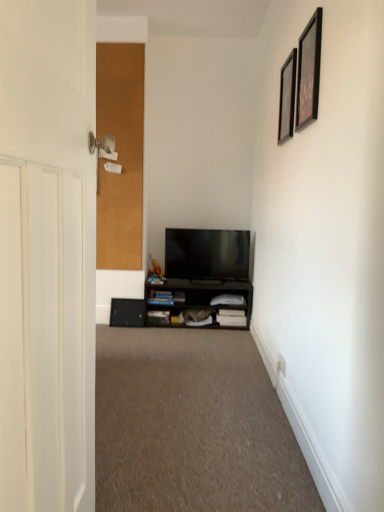
The width and height of the screenshot is (384, 512). What are the coordinates of `carpet at center` in the screenshot? It's located at (192, 426).

Find the location of `flat screen tv at center`. flat screen tv at center is located at coordinates (207, 254).

At what (x,y) coordinates should I click in order to perform the action: click on black matte cabinet at lower center. Please return your answer as a coordinate pair (x, y). Looking at the image, I should click on (196, 298).

The image size is (384, 512). What do you see at coordinates (196, 298) in the screenshot?
I see `black matte cabinet at lower center` at bounding box center [196, 298].

This screenshot has height=512, width=384. What do you see at coordinates (120, 155) in the screenshot?
I see `corkboard at left, which is the 1th door from left to right` at bounding box center [120, 155].

This screenshot has width=384, height=512. What are the coordinates of `white wooden door at left, which is the first door from right to left` in the screenshot? It's located at (47, 255).

The image size is (384, 512). What are the coordinates of `black matte picture frame at upper right, the 2th picture frame viewed from the front` in the screenshot? It's located at (287, 98).

Measure the distance between black glossy picture frame at upper right, the 2th picture frame when ordered from back to front, and camera.

5.89 feet.

The image size is (384, 512). I want to click on carpet at center, so click(x=192, y=426).

Between black matte cabinet at lower center and black glossy picture frame at upper right, the 2th picture frame when ordered from back to front, which one has larger width?

black matte cabinet at lower center is wider.

I want to click on cabinetry behind the black glossy picture frame at upper right, the 2th picture frame when ordered from back to front, so click(196, 298).

Which point is more forward, [152,284] or [309,40]?

Positioned in front is point [309,40].

How much distance is there between black matte cabinet at lower center and black glossy picture frame at upper right, acting as the first picture frame starting from the front?

1.88 meters.

Is black matte picture frame at upper right, which is the first picture frame from back to front, facing towards flat screen tv at center?

No, black matte picture frame at upper right, which is the first picture frame from back to front, is not turned towards flat screen tv at center.

Looking at their sizes, would you say black matte picture frame at upper right, which is the first picture frame from back to front, is wider or thinner than flat screen tv at center?

Clearly, black matte picture frame at upper right, which is the first picture frame from back to front, has less width compared to flat screen tv at center.

Is flat screen tv at center inside black matte picture frame at upper right, the 2th picture frame viewed from the front?

No, flat screen tv at center is not inside black matte picture frame at upper right, the 2th picture frame viewed from the front.

Is black matte picture frame at upper right, the 2th picture frame viewed from the front, far from flat screen tv at center?

Indeed, black matte picture frame at upper right, the 2th picture frame viewed from the front, is not near flat screen tv at center.

Is black matte cabinet at lower center turned away from white wooden door at left, arranged as the first door when viewed from the front?

black matte cabinet at lower center does not have its back to white wooden door at left, arranged as the first door when viewed from the front.

Considering the sizes of black matte cabinet at lower center and white wooden door at left, which is the first door from right to left, in the image, is black matte cabinet at lower center taller or shorter than white wooden door at left, which is the first door from right to left,?

Clearly, black matte cabinet at lower center is shorter compared to white wooden door at left, which is the first door from right to left.

Looking at this image, from the image's perspective, which one is positioned higher, black matte cabinet at lower center or white wooden door at left, acting as the 2th door starting from the back?

From the image's view, white wooden door at left, acting as the 2th door starting from the back, is above.

Is black matte cabinet at lower center placed right next to white wooden door at left, arranged as the first door when viewed from the front?

No, black matte cabinet at lower center is not beside white wooden door at left, arranged as the first door when viewed from the front.

Can you confirm if carpet at center is smaller than black glossy picture frame at upper right, acting as the first picture frame starting from the front?

Actually, carpet at center might be larger than black glossy picture frame at upper right, acting as the first picture frame starting from the front.

Is carpet at center oriented away from black glossy picture frame at upper right, the 2th picture frame when ordered from back to front?

No.

Is point (266, 504) closer or farther from the camera than point (301, 92)?

Point (266, 504) is closer to the camera than point (301, 92).

What's the angular difference between white wooden door at left, marked as the second door in a left-to-right arrangement, and corkboard at left, which is the 1th door from left to right,'s facing directions?

The angular difference between white wooden door at left, marked as the second door in a left-to-right arrangement, and corkboard at left, which is the 1th door from left to right, is 91.6 degrees.

From the picture: Is white wooden door at left, arranged as the first door when viewed from the front, directly adjacent to corkboard at left, the first door when ordered from back to front?

No, white wooden door at left, arranged as the first door when viewed from the front, is not making contact with corkboard at left, the first door when ordered from back to front.

Based on the photo, from the image's perspective, between white wooden door at left, which is the first door from right to left, and corkboard at left, the first door when ordered from back to front, which one is located above?

From the image's view, corkboard at left, the first door when ordered from back to front, is above.

Between point (9, 226) and point (98, 57), which one is positioned behind?

The point (98, 57) is behind.

Considering the relative positions of white wooden door at left, arranged as the first door when viewed from the front, and black matte picture frame at upper right, the 2th picture frame viewed from the front, in the image provided, is white wooden door at left, arranged as the first door when viewed from the front, to the left of black matte picture frame at upper right, the 2th picture frame viewed from the front, from the viewer's perspective?

Yes, white wooden door at left, arranged as the first door when viewed from the front, is to the left of black matte picture frame at upper right, the 2th picture frame viewed from the front.

Are white wooden door at left, acting as the 2th door starting from the back, and black matte picture frame at upper right, which is the first picture frame from back to front, making contact?

No, white wooden door at left, acting as the 2th door starting from the back, is not making contact with black matte picture frame at upper right, which is the first picture frame from back to front.

Can you tell me how much white wooden door at left, acting as the 2th door starting from the back, and black matte picture frame at upper right, which is the first picture frame from back to front, differ in facing direction?

The angle between the facing direction of white wooden door at left, acting as the 2th door starting from the back, and the facing direction of black matte picture frame at upper right, which is the first picture frame from back to front, is 180 degrees.

From the image's perspective, is white wooden door at left, acting as the 2th door starting from the back, located above or below black matte picture frame at upper right, the 2th picture frame viewed from the front?

Clearly, from the image's perspective, white wooden door at left, acting as the 2th door starting from the back, is below black matte picture frame at upper right, the 2th picture frame viewed from the front.

Considering the relative positions of black glossy picture frame at upper right, acting as the first picture frame starting from the front, and black matte picture frame at upper right, the 2th picture frame viewed from the front, in the image provided, is black glossy picture frame at upper right, acting as the first picture frame starting from the front, to the left of black matte picture frame at upper right, the 2th picture frame viewed from the front, from the viewer's perspective?

Yes.

Can you confirm if black glossy picture frame at upper right, the 2th picture frame when ordered from back to front, is bigger than black matte picture frame at upper right, which is the first picture frame from back to front?

Yes.

Find the location of a particular element. This screenshot has height=512, width=384. picture frame to the right of black glossy picture frame at upper right, acting as the first picture frame starting from the front is located at coordinates (287, 98).

Considering the sizes of objects black glossy picture frame at upper right, acting as the first picture frame starting from the front, and black matte picture frame at upper right, the 2th picture frame viewed from the front, in the image provided, who is wider, black glossy picture frame at upper right, acting as the first picture frame starting from the front, or black matte picture frame at upper right, the 2th picture frame viewed from the front,?

black glossy picture frame at upper right, acting as the first picture frame starting from the front.

You are a GUI agent. You are given a task and a screenshot of the screen. Output one action in this format:
    pyautogui.click(x=<x>, y=<y>)
    Task: Click on the 2nd picture frame directly above the black matte cabinet at lower center (from a real-world perspective)
    This screenshot has height=512, width=384.
    Given the screenshot: What is the action you would take?
    pyautogui.click(x=309, y=71)

Where is `the 2nd picture frame above the flat screen tv at center (from the image's perspective)`? The width and height of the screenshot is (384, 512). the 2nd picture frame above the flat screen tv at center (from the image's perspective) is located at coordinates (287, 98).

Based on their spatial positions, is flat screen tv at center or black matte picture frame at upper right, the 2th picture frame viewed from the front, further from black glossy picture frame at upper right, the 2th picture frame when ordered from back to front?

flat screen tv at center.

Which object lies further to the anchor point black glossy picture frame at upper right, acting as the first picture frame starting from the front, black matte cabinet at lower center or carpet at center?

black matte cabinet at lower center is positioned further to the anchor black glossy picture frame at upper right, acting as the first picture frame starting from the front.

Considering their positions, is flat screen tv at center positioned closer to black matte picture frame at upper right, which is the first picture frame from back to front, than corkboard at left, which is the 1th door from left to right?

flat screen tv at center lies closer to black matte picture frame at upper right, which is the first picture frame from back to front, than the other object.

Based on their spatial positions, is carpet at center or black glossy picture frame at upper right, the 2th picture frame when ordered from back to front, further from black matte cabinet at lower center?

black glossy picture frame at upper right, the 2th picture frame when ordered from back to front, lies further to black matte cabinet at lower center than the other object.

Considering their positions, is carpet at center positioned closer to black glossy picture frame at upper right, acting as the first picture frame starting from the front, than black matte picture frame at upper right, which is the first picture frame from back to front?

The object closer to black glossy picture frame at upper right, acting as the first picture frame starting from the front, is black matte picture frame at upper right, which is the first picture frame from back to front.

When comparing their distances from carpet at center, does black glossy picture frame at upper right, acting as the first picture frame starting from the front, or white wooden door at left, acting as the 2th door starting from the back, seem further?

black glossy picture frame at upper right, acting as the first picture frame starting from the front, is positioned further to the anchor carpet at center.

When comparing their distances from white wooden door at left, acting as the 2th door starting from the back, does carpet at center or corkboard at left, which appears as the second door when viewed from the front, seem closer?

carpet at center is positioned closer to the anchor white wooden door at left, acting as the 2th door starting from the back.

When comparing their distances from black matte picture frame at upper right, the 2th picture frame viewed from the front, does white wooden door at left, arranged as the first door when viewed from the front, or black glossy picture frame at upper right, acting as the first picture frame starting from the front, seem further?

Based on the image, white wooden door at left, arranged as the first door when viewed from the front, appears to be further to black matte picture frame at upper right, the 2th picture frame viewed from the front.

Locate an element on the screen. door between white wooden door at left, marked as the second door in a left-to-right arrangement, and black matte cabinet at lower center, along the z-axis is located at coordinates (120, 155).

Find the location of a particular element. This screenshot has width=384, height=512. picture frame between white wooden door at left, marked as the second door in a left-to-right arrangement, and black matte picture frame at upper right, which is the first picture frame from back to front, along the z-axis is located at coordinates (x=309, y=71).

I want to click on plain located between white wooden door at left, which is the first door from right to left, and corkboard at left, arranged as the 2th door when viewed from the right, in the depth direction, so click(x=192, y=426).

Where is `plain between white wooden door at left, which is the first door from right to left, and flat screen tv at center in the front-back direction`? plain between white wooden door at left, which is the first door from right to left, and flat screen tv at center in the front-back direction is located at coordinates (192, 426).